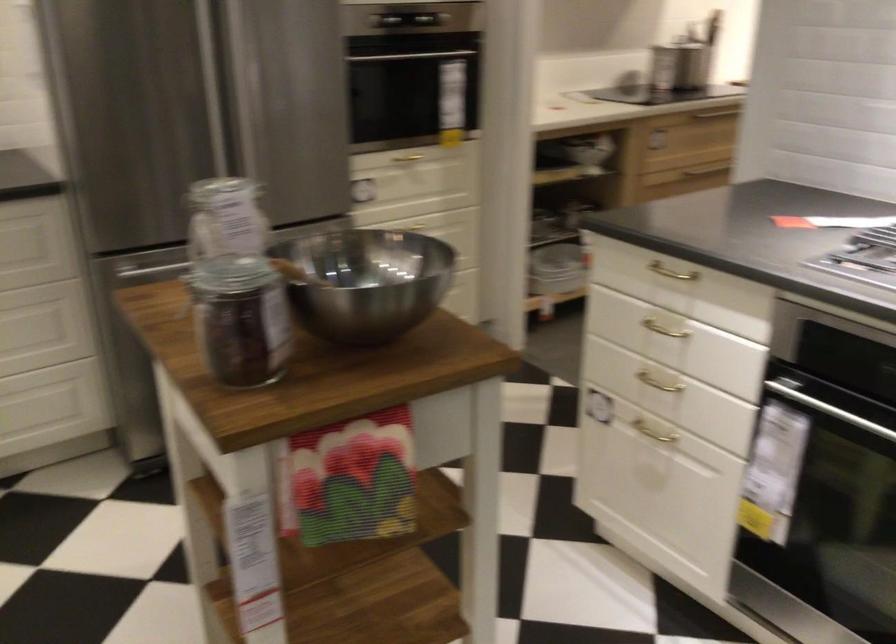
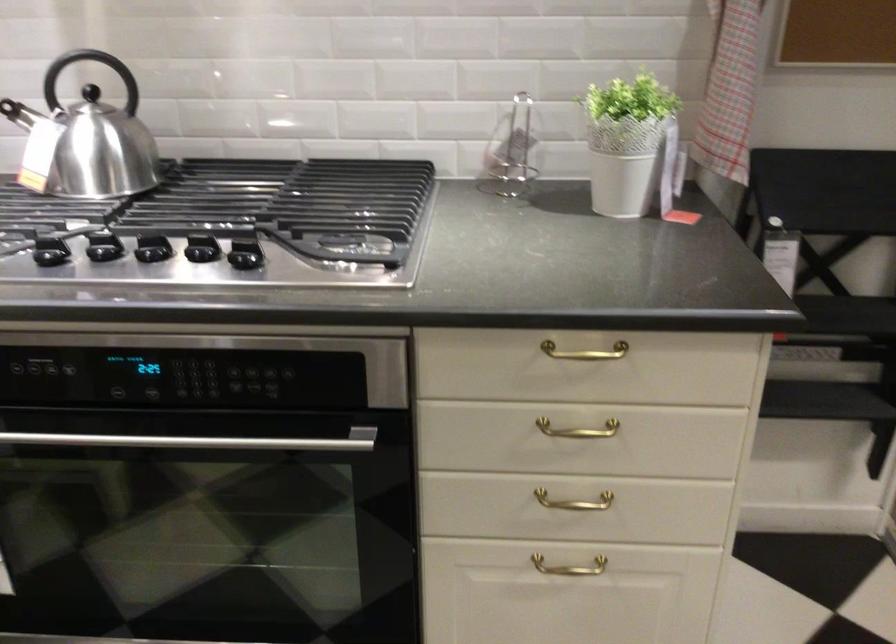
Question: The images are taken continuously from a first-person perspective. In which direction is your viewpoint rotating?

Choices:
 (A) Left
 (B) Right
 (C) Up
 (D) Down

Answer: (B)